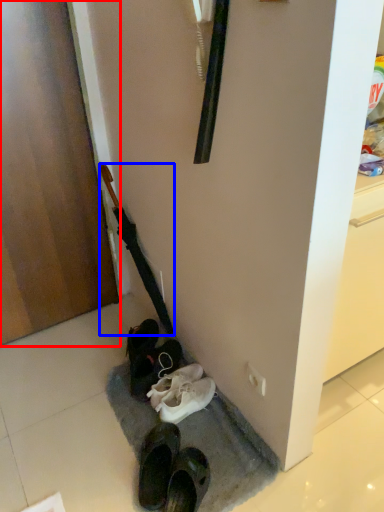
Question: Which object appears farthest to the camera in this image, door (highlighted by a red box) or umbrella (highlighted by a blue box)?

Choices:
 (A) door
 (B) umbrella

Answer: (B)